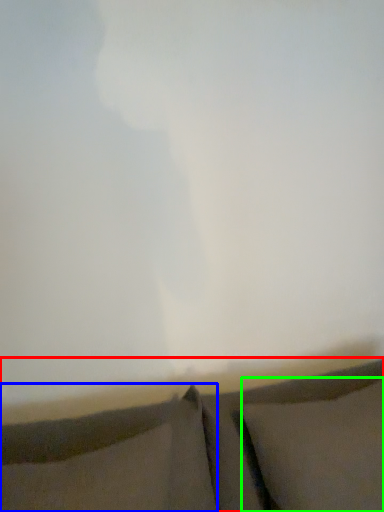
Question: Which is nearer to the furniture (highlighted by a red box)? pillow (highlighted by a blue box) or pillow (highlighted by a green box).

Choices:
 (A) pillow
 (B) pillow

Answer: (A)